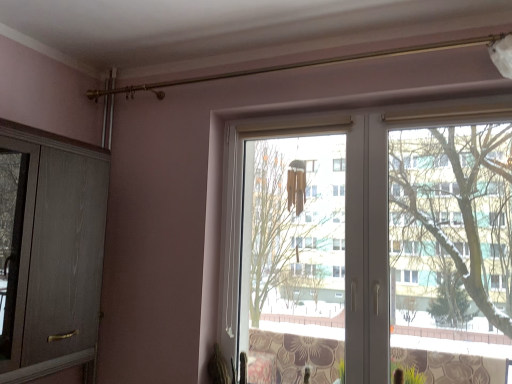
Question: Does point (48, 324) appear closer or farther from the camera than point (444, 238)?

Choices:
 (A) closer
 (B) farther

Answer: (A)

Question: In the image, is matte wood screen door at left positioned in front of or behind white plastic window at center?

Choices:
 (A) front
 (B) behind

Answer: (A)

Question: Considering the relative positions of matte wood screen door at left and white plastic window at center in the image provided, is matte wood screen door at left to the left or to the right of white plastic window at center?

Choices:
 (A) left
 (B) right

Answer: (A)

Question: Considering their positions, is white plastic window at center located in front of or behind matte wood screen door at left?

Choices:
 (A) front
 (B) behind

Answer: (B)

Question: In terms of width, does white plastic window at center look wider or thinner when compared to matte wood screen door at left?

Choices:
 (A) thin
 (B) wide

Answer: (A)

Question: Based on their positions, is white plastic window at center located to the left or right of matte wood screen door at left?

Choices:
 (A) right
 (B) left

Answer: (A)

Question: Is white plastic window at center taller or shorter than matte wood screen door at left?

Choices:
 (A) short
 (B) tall

Answer: (B)